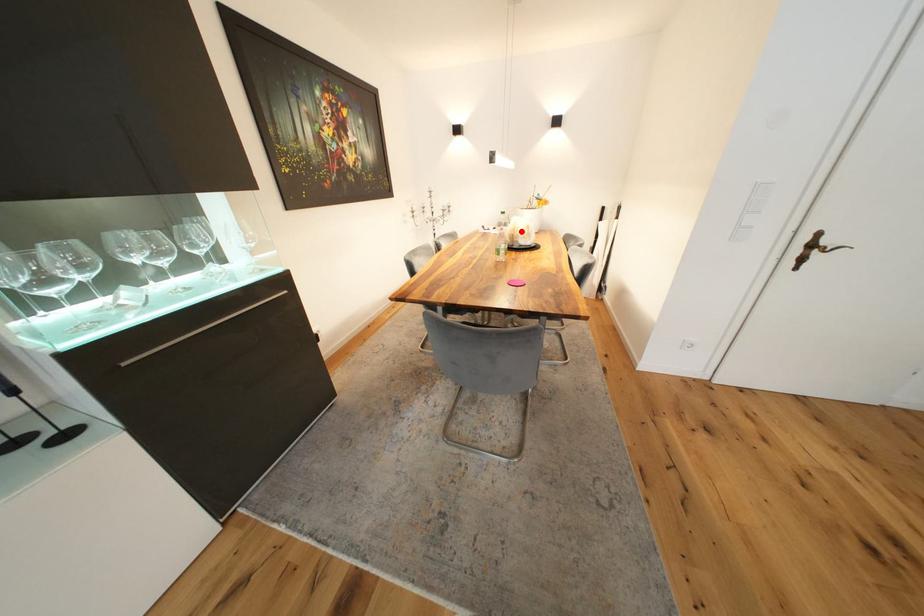
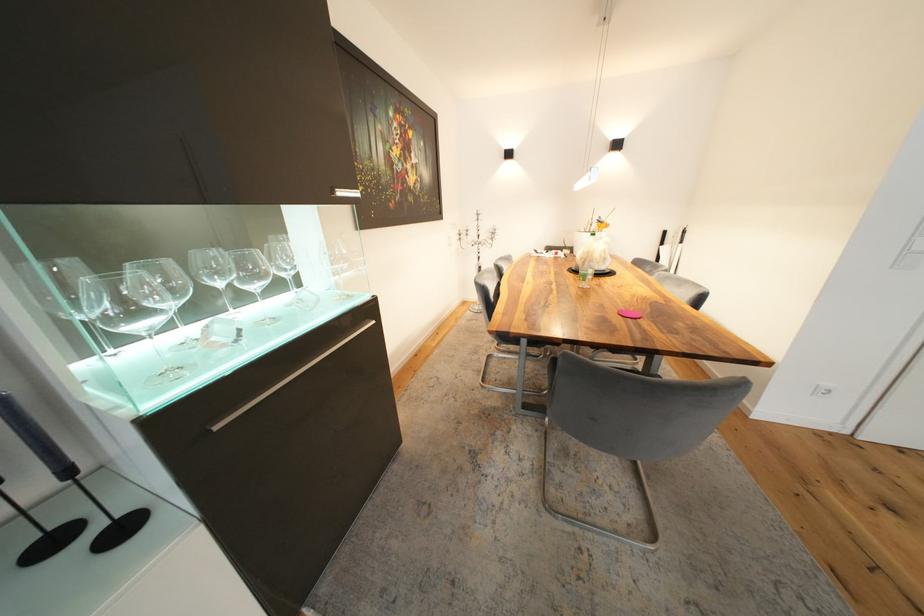
Find the pixel in the second image that matches the highlighted location in the first image.

(594, 254)